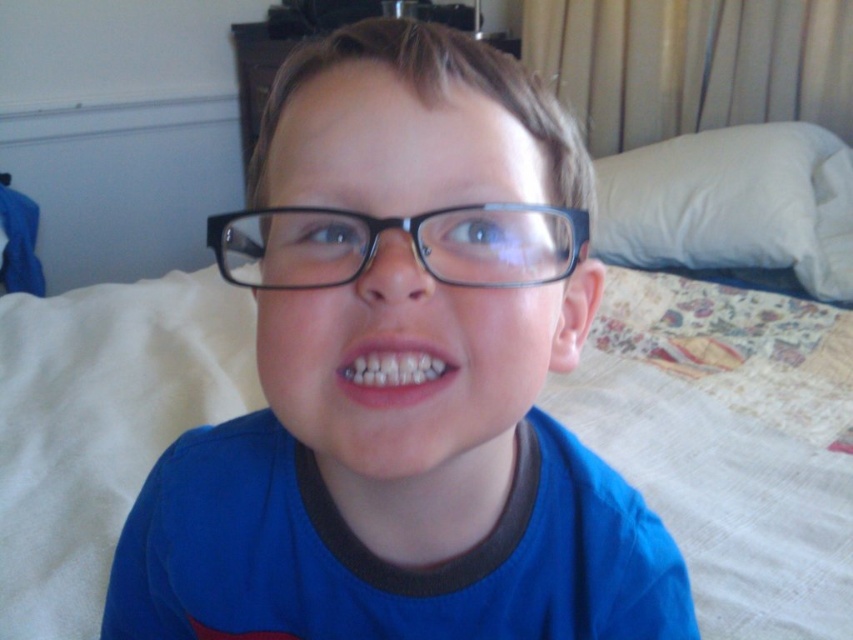
Question: Estimate the real-world distances between objects in this image. Which object is farther from the white glossy teeth at center?

Choices:
 (A) white fabric bed at center
 (B) white soft pillow at right

Answer: (B)

Question: Observing the image, what is the correct spatial positioning of blue matte shirt at center in reference to white soft pillow at right?

Choices:
 (A) below
 (B) above

Answer: (A)

Question: Considering the real-world distances, which object is closest to the black plastic glasses at center?

Choices:
 (A) blue matte shirt at center
 (B) white fabric bed at center

Answer: (A)

Question: Is white soft pillow at right thinner than white glossy teeth at center?

Choices:
 (A) no
 (B) yes

Answer: (A)

Question: Which point is farther from the camera taking this photo?

Choices:
 (A) (306, 268)
 (B) (723, 266)
 (C) (68, 545)

Answer: (B)

Question: Can you confirm if blue matte shirt at center is thinner than white glossy teeth at center?

Choices:
 (A) no
 (B) yes

Answer: (A)